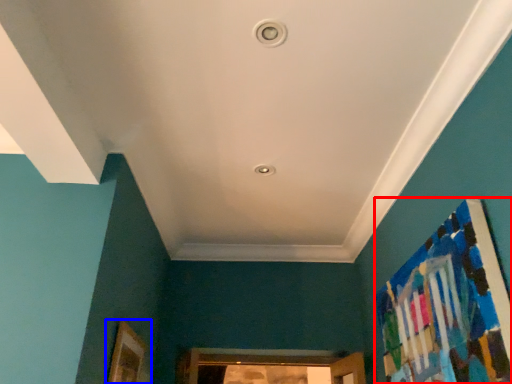
Question: Which of the following is the closest to the observer, bulletin board (highlighted by a red box) or picture frame (highlighted by a blue box)?

Choices:
 (A) bulletin board
 (B) picture frame

Answer: (A)